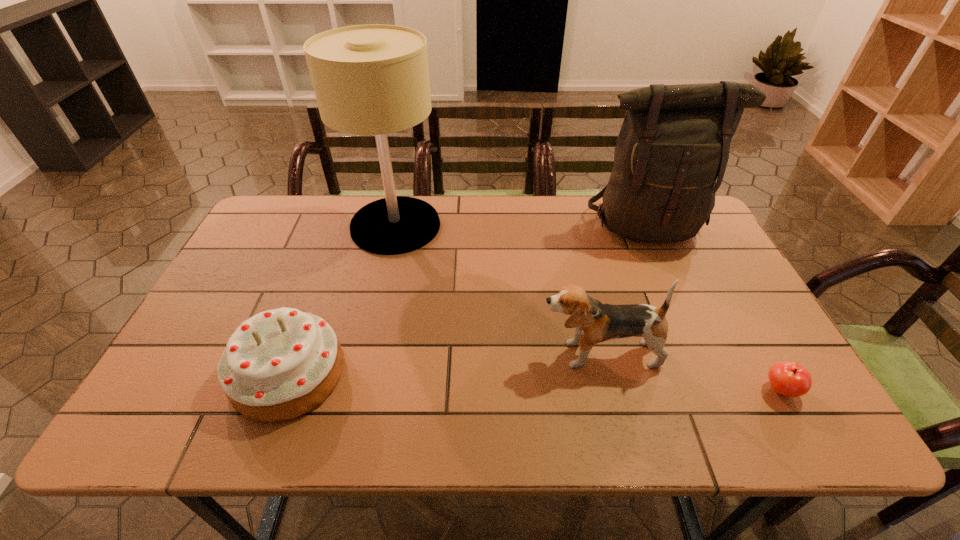
Identify the location of object that is at the far right corner. The image size is (960, 540). (674, 142).

Where is `object situated at the near right corner`? Image resolution: width=960 pixels, height=540 pixels. object situated at the near right corner is located at coordinates (788, 378).

This screenshot has width=960, height=540. Find the location of `free space at the far edge of the desktop`. free space at the far edge of the desktop is located at coordinates (557, 235).

Identify the location of vacant space at the near edge. (350, 408).

Identify the location of vacant space at the left edge of the desktop. The image size is (960, 540). (229, 303).

You are a GUI agent. You are given a task and a screenshot of the screen. Output one action in this format:
    pyautogui.click(x=<x>, y=<y>)
    Task: Click on the free point at the right edge
    
    Given the screenshot: What is the action you would take?
    pyautogui.click(x=742, y=379)

The width and height of the screenshot is (960, 540). I want to click on vacant space at the far left corner, so click(301, 234).

The width and height of the screenshot is (960, 540). I want to click on vacant region at the far right corner of the desktop, so click(710, 235).

This screenshot has height=540, width=960. In order to click on blank region between the puppy and the cake in this screenshot , I will do `click(444, 364)`.

At what (x,y) coordinates should I click in order to perform the action: click on free spot between the third shortest object and the second tallest object. Please return your answer as a coordinate pair (x, y). The width and height of the screenshot is (960, 540). Looking at the image, I should click on (623, 290).